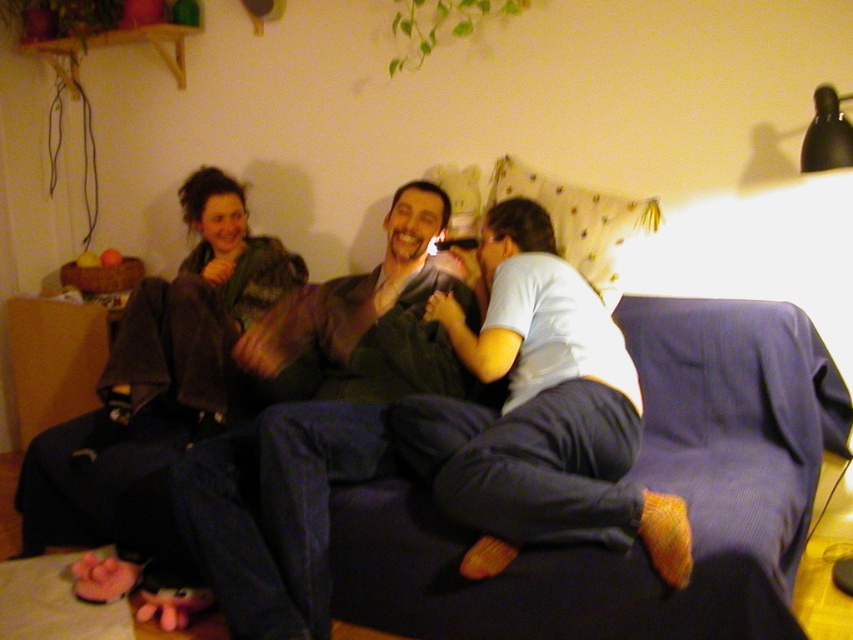
Question: Does blue corduroy couch at center have a smaller size compared to shiny brown jacket at center?

Choices:
 (A) no
 (B) yes

Answer: (A)

Question: Can you confirm if blue corduroy couch at center is bigger than shiny brown jacket at center?

Choices:
 (A) no
 (B) yes

Answer: (B)

Question: Which object appears closest to the camera in this image?

Choices:
 (A) shiny brown jacket at center
 (B) blue corduroy couch at center

Answer: (B)

Question: Does blue corduroy couch at center have a larger size compared to shiny brown jacket at center?

Choices:
 (A) no
 (B) yes

Answer: (B)

Question: Which point is farther to the camera?

Choices:
 (A) shiny brown jacket at center
 (B) blue corduroy couch at center

Answer: (A)